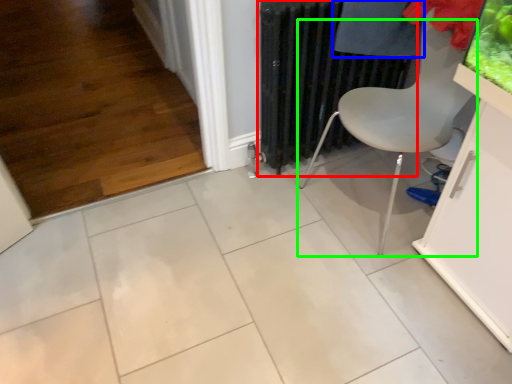
Question: Which object is positioned closest to radiator (highlighted by a red box)? Select from clothing (highlighted by a blue box) and chair (highlighted by a green box).

Choices:
 (A) clothing
 (B) chair

Answer: (A)